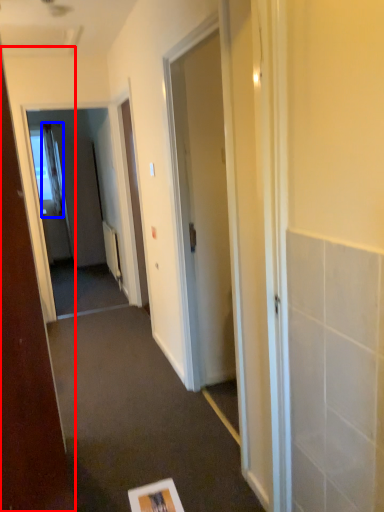
Question: Which point is further to the camera, door (highlighted by a red box) or curtain (highlighted by a blue box)?

Choices:
 (A) door
 (B) curtain

Answer: (B)